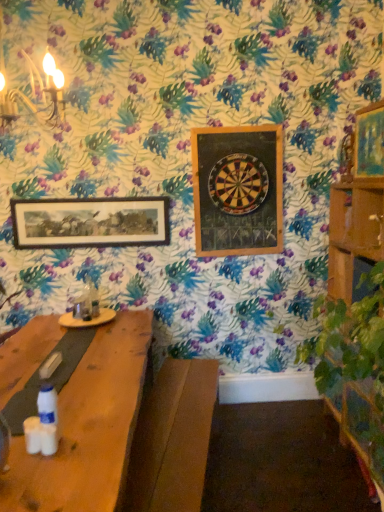
Question: Could wooden dartboard at center be considered to be inside wooden dartboard at upper center, which is counted as the 2th picture frame, starting from the left?

Choices:
 (A) yes
 (B) no

Answer: (B)

Question: Is wooden dartboard at upper center, arranged as the 2th picture frame when viewed from the right, smaller than wooden dartboard at center?

Choices:
 (A) no
 (B) yes

Answer: (A)

Question: Is wooden dartboard at upper center, arranged as the 2th picture frame when viewed from the right, outside wooden dartboard at center?

Choices:
 (A) yes
 (B) no

Answer: (A)

Question: Is wooden dartboard at upper center, which is counted as the 2th picture frame, starting from the left, shorter than wooden dartboard at center?

Choices:
 (A) yes
 (B) no

Answer: (B)

Question: From a real-world perspective, is wooden dartboard at upper center, which is the 2th picture frame in front-to-back order, beneath wooden dartboard at center?

Choices:
 (A) no
 (B) yes

Answer: (B)

Question: Choose the correct answer: Is wooden dartboard at center inside matte gold picture frame at upper right, marked as the 3th picture frame in a back-to-front arrangement, or outside it?

Choices:
 (A) inside
 (B) outside

Answer: (B)

Question: Is wooden dartboard at center in front of or behind matte gold picture frame at upper right, acting as the first picture frame starting from the right, in the image?

Choices:
 (A) front
 (B) behind

Answer: (B)

Question: Considering the positions of wooden dartboard at center and matte gold picture frame at upper right, acting as the first picture frame starting from the right, in the image, is wooden dartboard at center wider or thinner than matte gold picture frame at upper right, acting as the first picture frame starting from the right,?

Choices:
 (A) wide
 (B) thin

Answer: (B)

Question: Considering the positions of wooden dartboard at center and matte gold picture frame at upper right, placed as the first picture frame when sorted from front to back, in the image, is wooden dartboard at center taller or shorter than matte gold picture frame at upper right, placed as the first picture frame when sorted from front to back,?

Choices:
 (A) tall
 (B) short

Answer: (A)

Question: Looking at the image, does wooden dartboard at center seem bigger or smaller compared to wooden dartboard at upper center, which is the second picture frame from back to front?

Choices:
 (A) big
 (B) small

Answer: (B)

Question: Based on their positions, is wooden dartboard at center located to the left or right of wooden dartboard at upper center, which is the second picture frame from back to front?

Choices:
 (A) right
 (B) left

Answer: (B)

Question: From the image's perspective, relative to wooden dartboard at upper center, which is the 2th picture frame in front-to-back order, is wooden dartboard at center above or below?

Choices:
 (A) below
 (B) above

Answer: (B)

Question: Does point (213, 185) appear closer or farther from the camera than point (246, 135)?

Choices:
 (A) closer
 (B) farther

Answer: (B)

Question: Considering the relative positions of wooden dartboard at upper center, which is counted as the 2th picture frame, starting from the left, and matte gold picture frame at upper right, placed as the first picture frame when sorted from front to back, in the image provided, is wooden dartboard at upper center, which is counted as the 2th picture frame, starting from the left, to the left or to the right of matte gold picture frame at upper right, placed as the first picture frame when sorted from front to back,?

Choices:
 (A) left
 (B) right

Answer: (A)

Question: Relative to matte gold picture frame at upper right, acting as the first picture frame starting from the right, is wooden dartboard at upper center, which is the 2th picture frame in front-to-back order, in front or behind?

Choices:
 (A) behind
 (B) front

Answer: (A)